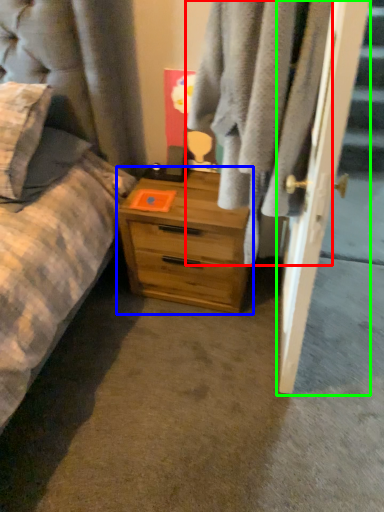
Question: Considering the real-world distances, which object is farthest from clothing (highlighted by a red box)? chest of drawers (highlighted by a blue box) or door (highlighted by a green box)?

Choices:
 (A) chest of drawers
 (B) door

Answer: (A)